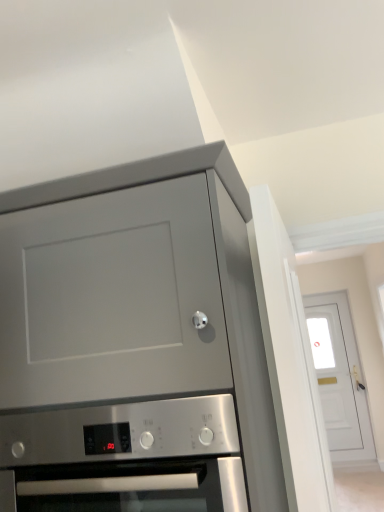
Question: Is stainless steel oven at lower center oriented away from matte gray cabinet at upper left?

Choices:
 (A) yes
 (B) no

Answer: (A)

Question: Is stainless steel oven at lower center not within matte gray cabinet at upper left?

Choices:
 (A) no
 (B) yes

Answer: (A)

Question: Is stainless steel oven at lower center taller than matte gray cabinet at upper left?

Choices:
 (A) no
 (B) yes

Answer: (A)

Question: Is stainless steel oven at lower center to the left of matte gray cabinet at upper left from the viewer's perspective?

Choices:
 (A) no
 (B) yes

Answer: (A)

Question: Can you confirm if stainless steel oven at lower center is positioned to the right of matte gray cabinet at upper left?

Choices:
 (A) yes
 (B) no

Answer: (A)

Question: Does stainless steel oven at lower center have a lesser width compared to matte gray cabinet at upper left?

Choices:
 (A) yes
 (B) no

Answer: (A)

Question: Is matte gray cabinet at upper left positioned far away from white glossy door at upper right?

Choices:
 (A) yes
 (B) no

Answer: (A)

Question: Considering the relative sizes of matte gray cabinet at upper left and white glossy door at upper right in the image provided, is matte gray cabinet at upper left shorter than white glossy door at upper right?

Choices:
 (A) yes
 (B) no

Answer: (A)

Question: Could white glossy door at upper right be considered to be inside matte gray cabinet at upper left?

Choices:
 (A) no
 (B) yes

Answer: (A)

Question: Is matte gray cabinet at upper left positioned beyond the bounds of white glossy door at upper right?

Choices:
 (A) yes
 (B) no

Answer: (A)

Question: Can you confirm if matte gray cabinet at upper left is taller than white glossy door at upper right?

Choices:
 (A) yes
 (B) no

Answer: (B)

Question: Is matte gray cabinet at upper left wider than white glossy door at upper right?

Choices:
 (A) yes
 (B) no

Answer: (A)

Question: Considering the relative sizes of white glossy door at upper right and stainless steel oven at lower center in the image provided, is white glossy door at upper right wider than stainless steel oven at lower center?

Choices:
 (A) yes
 (B) no

Answer: (B)